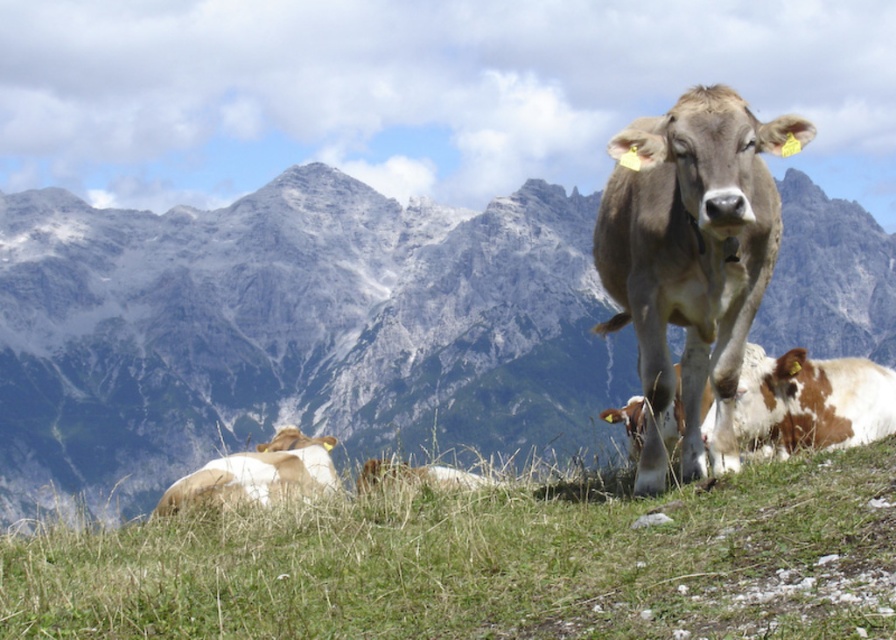
Looking at the scene, where is the gray rocky mountain range at upper center located in relation to the green grass at lower center?

The gray rocky mountain range at upper center is located to the right of the green grass at lower center.

You are a photographer standing on the grassy hill. You want to take a photo of the white and brown cow at lower left without the green grass at lower center blocking the view. Is it possible?

The green grass at lower center is in front of the white and brown cow at lower left, so it will block the view. Move to a position where the cow is between you and the grass to avoid obstruction.

You are a farmer checking the pasture. You notice the green grass at lower center and the white and brown cow at lower left. Which one is taller?

The green grass at lower center is taller than the white and brown cow at lower left according to the description.